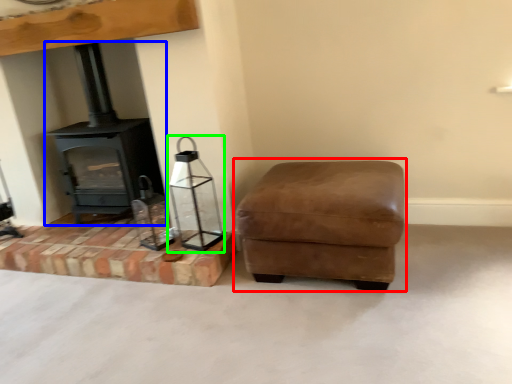
Question: Estimate the real-world distances between objects in this image. Which object is farther from rocking chair (highlighted by a red box), wood burning stove (highlighted by a blue box) or candle holder (highlighted by a green box)?

Choices:
 (A) wood burning stove
 (B) candle holder

Answer: (A)